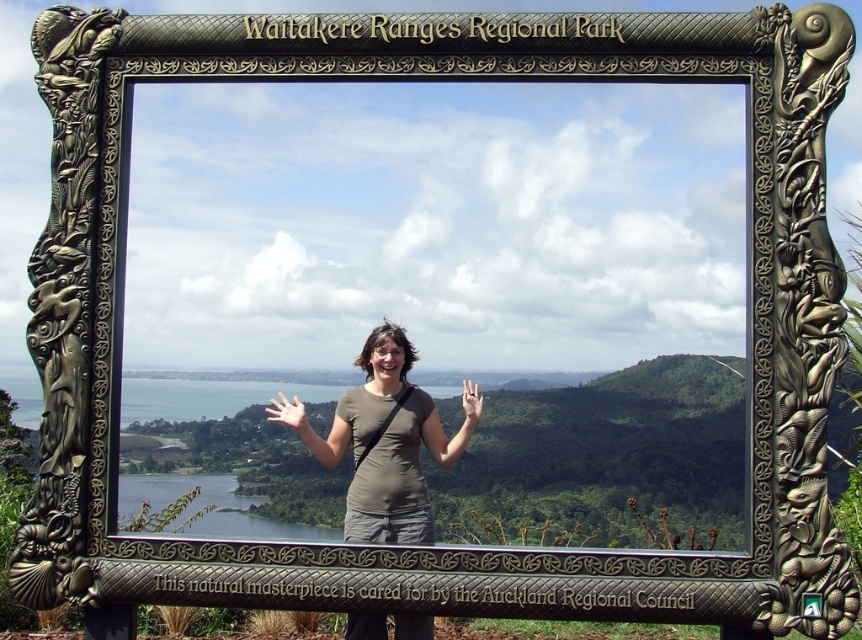
Question: Which of the following is the closest to the observer?

Choices:
 (A) (428, 518)
 (B) (288, 420)

Answer: (A)

Question: Is matte brown shirt at center to the left of matte skin hand at center from the viewer's perspective?

Choices:
 (A) no
 (B) yes

Answer: (B)

Question: Is white matte hand at center thinner than matte skin hand at center?

Choices:
 (A) no
 (B) yes

Answer: (A)

Question: Is white matte hand at center wider than matte skin hand at center?

Choices:
 (A) yes
 (B) no

Answer: (A)

Question: Which object is positioned closest to the matte skin hand at center?

Choices:
 (A) matte brown shirt at center
 (B) white matte hand at center

Answer: (A)

Question: Which of these objects is positioned closest to the white matte hand at center?

Choices:
 (A) matte skin hand at center
 (B) matte brown shirt at center

Answer: (B)